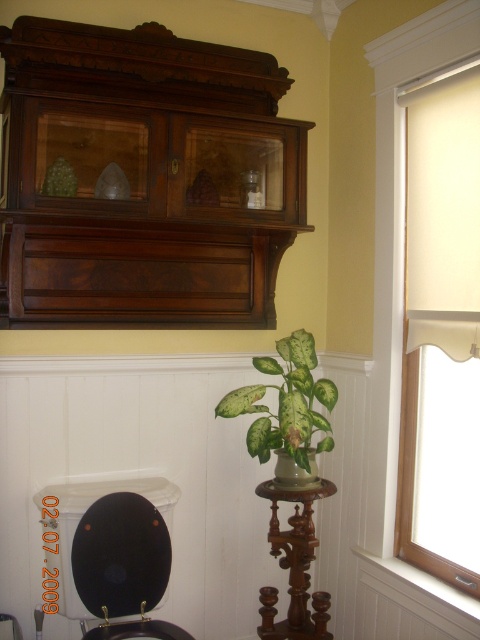
Who is lower down, green matte leafy plant at center or walnut wood candle holder at lower right?

walnut wood candle holder at lower right is below.

Looking at this image, is green matte leafy plant at center thinner than walnut wood candle holder at lower right?

No.

What do you see at coordinates (287, 410) in the screenshot? Image resolution: width=480 pixels, height=640 pixels. I see `green matte leafy plant at center` at bounding box center [287, 410].

Locate an element on the screen. The height and width of the screenshot is (640, 480). green matte leafy plant at center is located at coordinates [287, 410].

Who is more forward, (154, 557) or (165, 621)?

Positioned in front is point (165, 621).

Measure the distance between mahogany wood chiffonier at upper left and camera.

mahogany wood chiffonier at upper left and camera are 1.76 meters apart from each other.

Find the location of `mahogany wood chiffonier at upper left`. mahogany wood chiffonier at upper left is located at coordinates (113, 554).

Which of these two, walnut wood candle holder at lower right or black glossy toilet bowl at lower left, stands taller?

walnut wood candle holder at lower right is taller.

Can you confirm if walnut wood candle holder at lower right is wider than black glossy toilet bowl at lower left?

No.

Which is behind, point (284, 550) or point (189, 637)?

Point (284, 550)

What are the coordinates of `walnut wood candle holder at lower right` in the screenshot? It's located at (295, 566).